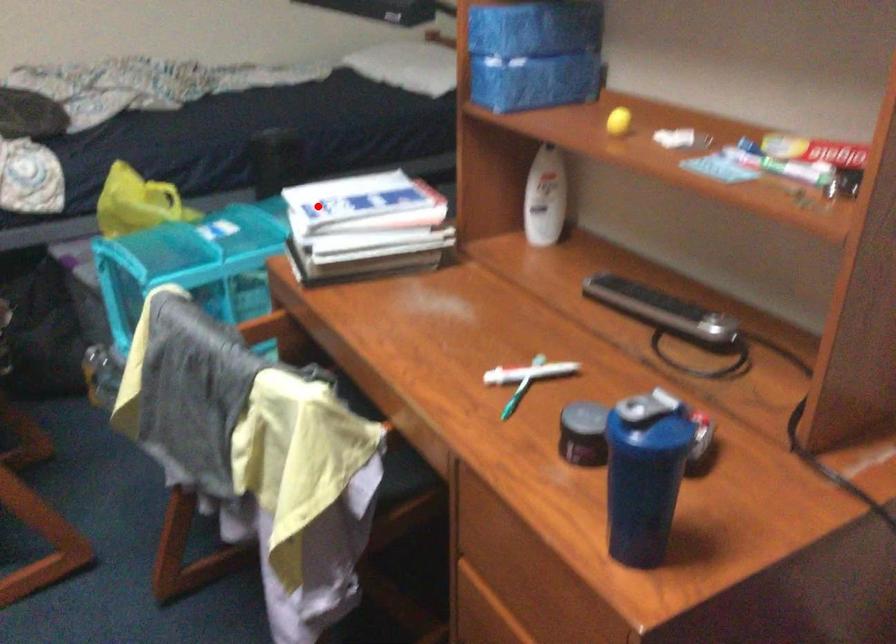
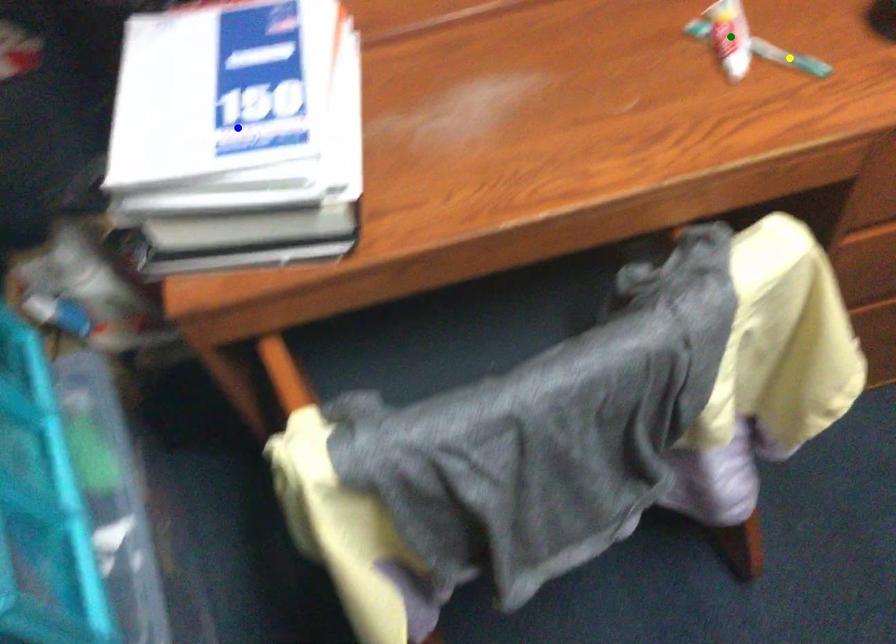
Question: I am providing you with two images of the same scene from different viewpoints. A red point is marked on the first image. You are given multiple points on the second image. Which point in image 2 represents the same 3d spot as the red point in image 1?

Choices:
 (A) blue point
 (B) green point
 (C) yellow point

Answer: (A)